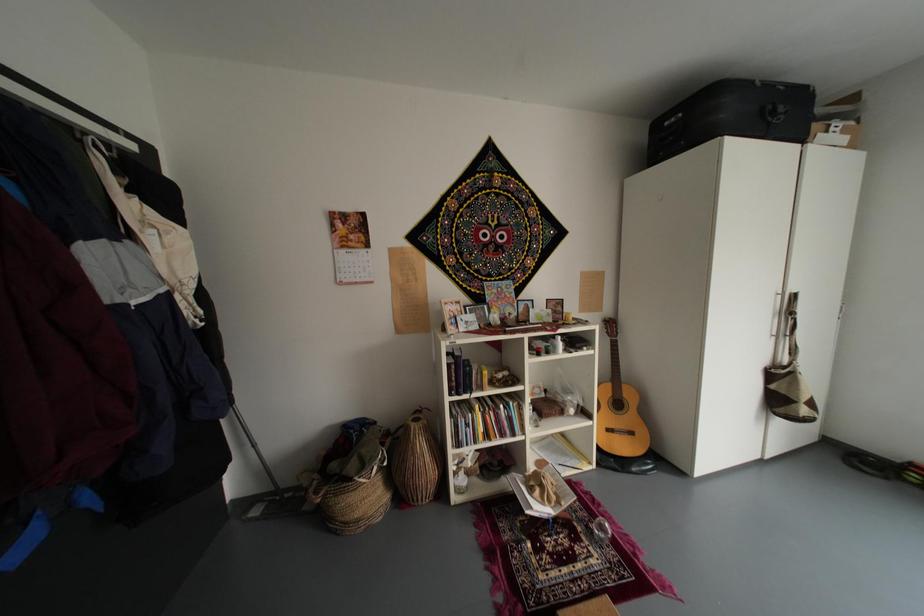
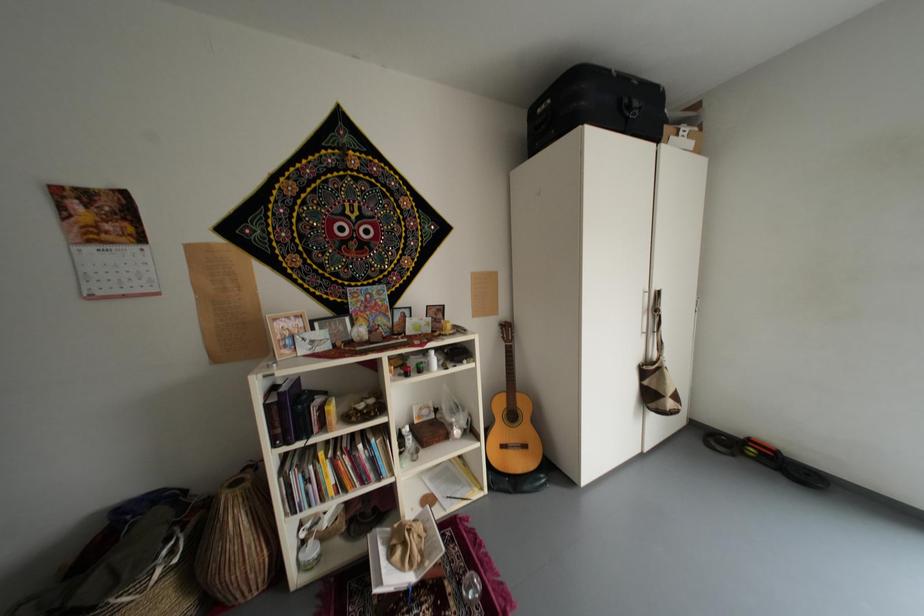
Question: The camera is either moving clockwise (left) or counter-clockwise (right) around the object. The first image is from the beginning of the video and the second image is from the end. Is the camera moving left or right when shooting the video?

Choices:
 (A) Left
 (B) Right

Answer: (A)